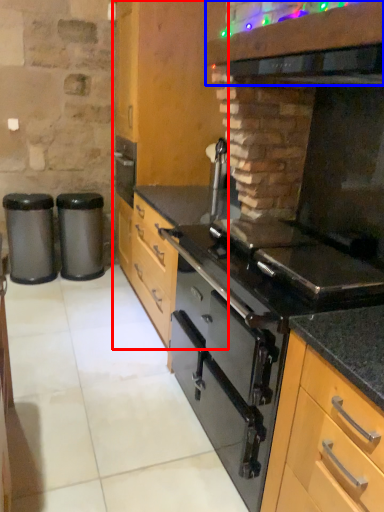
Question: Which point is further to the camera, cabinetry (highlighted by a red box) or vent (highlighted by a blue box)?

Choices:
 (A) cabinetry
 (B) vent

Answer: (A)